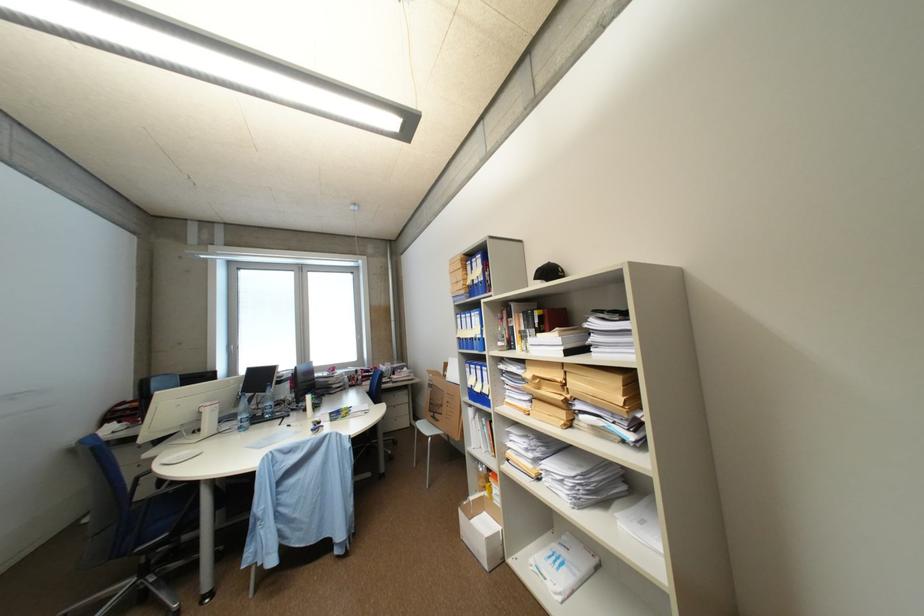
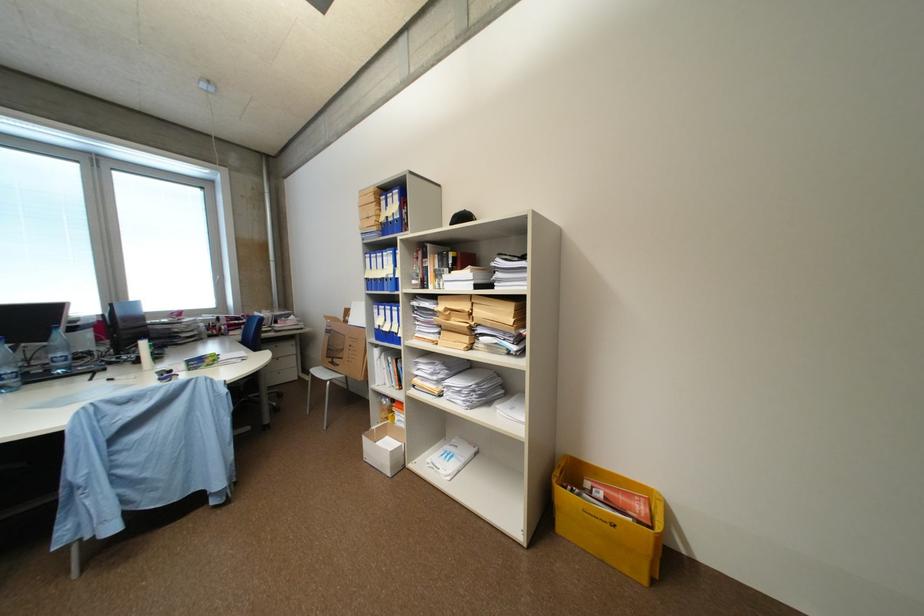
The point at (493,515) is marked in the first image. Where is the corresponding point in the second image?

(395, 439)